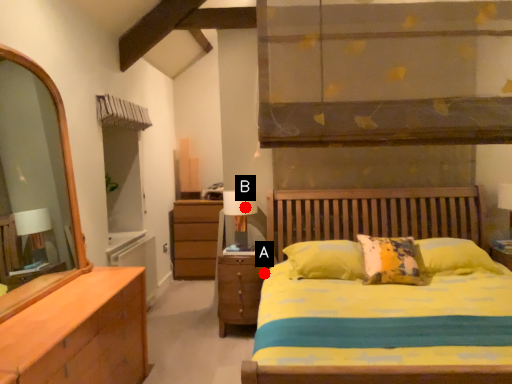
Question: Two points are circled on the image, labeled by A and B beside each circle. Which point appears farthest from the camera in this image?

Choices:
 (A) A is further
 (B) B is further

Answer: (A)